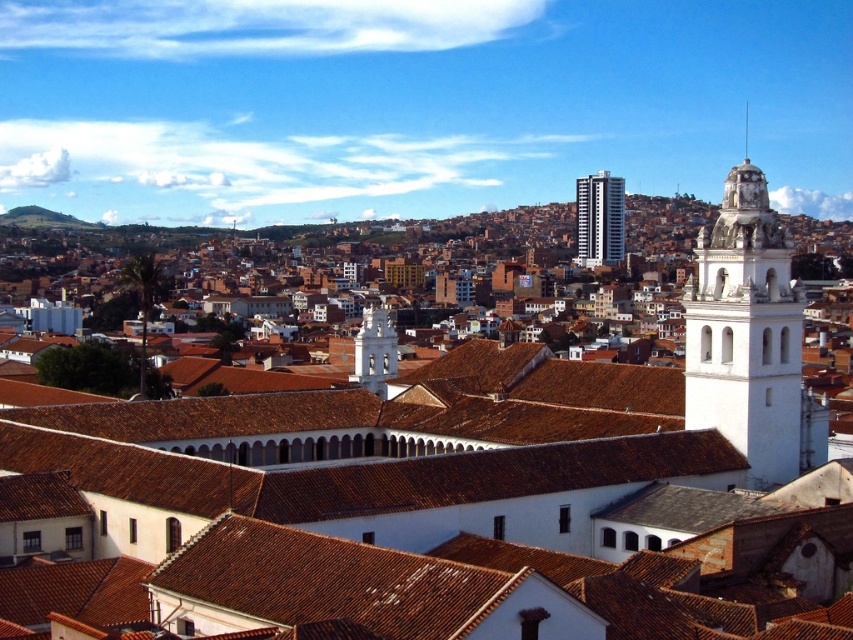
Is white matte church tower at upper right positioned at the back of white smooth bell tower at upper right?

No.

Does point (630, 497) lie in front of point (589, 176)?

Yes, point (630, 497) is in front of point (589, 176).

What do you see at coordinates (460, 488) in the screenshot? I see `white matte church tower at upper right` at bounding box center [460, 488].

Find the location of a particular element. Image resolution: width=853 pixels, height=640 pixels. white matte church tower at upper right is located at coordinates (460, 488).

Which is in front, point (577, 216) or point (743, 134)?

Positioned in front is point (577, 216).

Between white smooth bell tower at upper right and white smooth spire at upper right, which one appears on the right side from the viewer's perspective?

From the viewer's perspective, white smooth spire at upper right appears more on the right side.

Is point (590, 236) less distant than point (746, 132)?

Yes, it is.

Where is `white smooth bell tower at upper right`? The height and width of the screenshot is (640, 853). white smooth bell tower at upper right is located at coordinates (599, 218).

Is white stucco bell tower at upper right thinner than white stucco bell tower at center?

In fact, white stucco bell tower at upper right might be wider than white stucco bell tower at center.

This screenshot has width=853, height=640. Describe the element at coordinates (746, 332) in the screenshot. I see `white stucco bell tower at upper right` at that location.

Identify the location of white stucco bell tower at upper right. (746, 332).